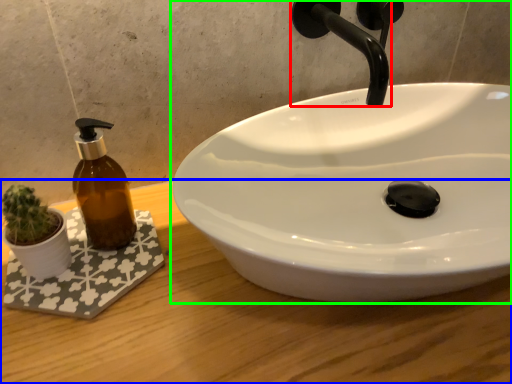
Question: Estimate the real-world distances between objects in this image. Which object is farther from tap (highlighted by a red box), counter top (highlighted by a blue box) or sink (highlighted by a green box)?

Choices:
 (A) counter top
 (B) sink

Answer: (A)